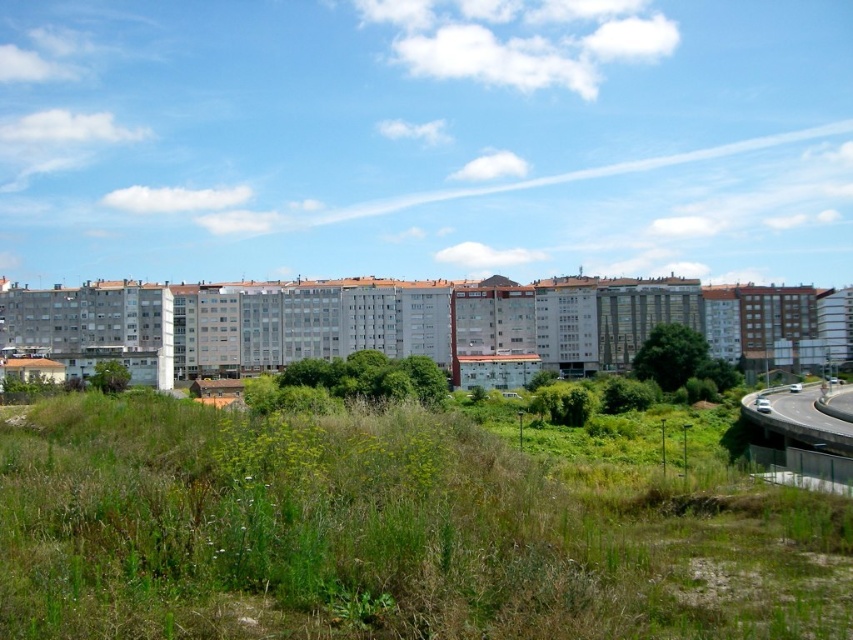
Question: Which object appears farthest from the camera in this image?

Choices:
 (A) green grassy at lower center
 (B) gray concrete highway at lower right

Answer: (B)

Question: Is green grassy at lower center wider than gray concrete highway at lower right?

Choices:
 (A) no
 (B) yes

Answer: (B)

Question: Is green grassy at lower center below gray concrete highway at lower right?

Choices:
 (A) no
 (B) yes

Answer: (A)

Question: Among these objects, which one is nearest to the camera?

Choices:
 (A) green grassy at lower center
 (B) gray concrete highway at lower right

Answer: (A)

Question: Is green grassy at lower center wider than gray concrete highway at lower right?

Choices:
 (A) no
 (B) yes

Answer: (B)

Question: Which object is closer to the camera taking this photo?

Choices:
 (A) gray concrete highway at lower right
 (B) green grassy at lower center

Answer: (B)